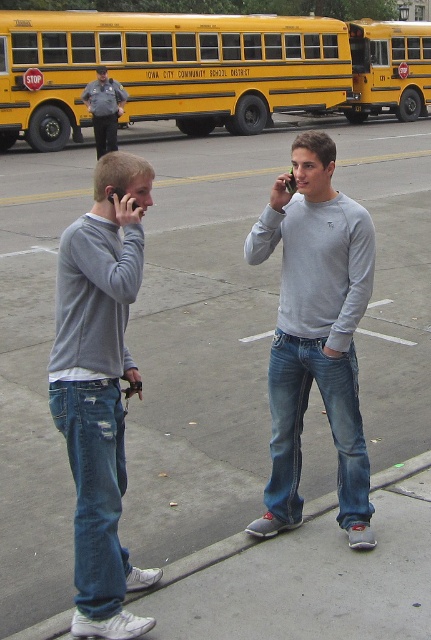
You are a delivery driver who needs to park your truck in the parking lot shown in the image. You notice the yellow painted school bus at upper center and the matte gray sweatshirt at center. Which object would block your truck from entering the parking space if you approach from the front?

The yellow painted school bus at upper center would block your truck from entering the parking space because it is larger in size compared to the matte gray sweatshirt at center.

You are a photographer trying to capture both the matte gray sweatshirt at center and the yellow painted metal school bus at center in a single frame. Given their sizes, which object should you position closer to the camera to ensure both appear balanced in the photo?

The matte gray sweatshirt at center is larger in size compared to the yellow painted metal school bus at center. To balance their sizes in the photo, you should position the yellow painted metal school bus at center closer to the camera while moving the matte gray sweatshirt at center further back.

You are a pedestrian trying to cross the road safely. You see the matte gray sweatshirt at center and the gray uniformed officer at upper left. Which one is closer to you?

The matte gray sweatshirt at center is closer to the viewer than the gray uniformed officer at upper left.